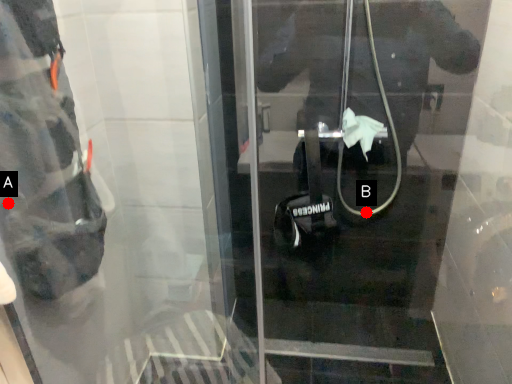
Question: Two points are circled on the image, labeled by A and B beside each circle. Which point is further to the camera?

Choices:
 (A) A is further
 (B) B is further

Answer: (B)